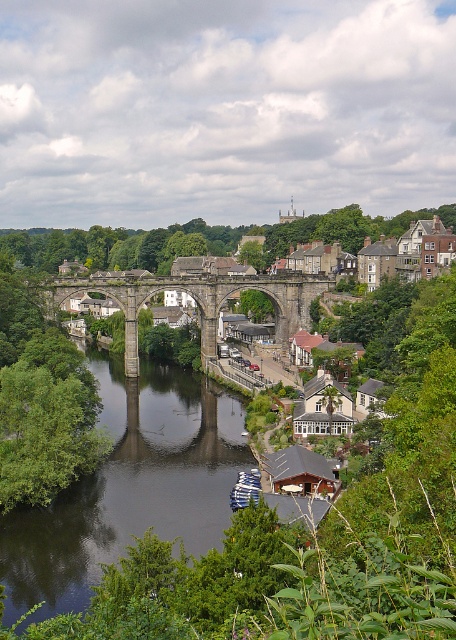
You are a tourist standing on the stone arch bridge at center and want to take a photo of the dark reflective water at center. Since the bridge is higher, will you need to look down to capture the water in your shot?

The dark reflective water at center has a lesser height compared to the stone arch bridge at center, so yes, you will need to look down to capture the water in your shot since the bridge is elevated above it.

You are a tour guide leading a group near the river. You want to point out both the dark reflective water at center and the stone arch bridge at center. If your arm can reach up to 100 feet, can you touch both objects with your outstretched hand at the same time?

The dark reflective water at center and the stone arch bridge at center are 113.69 feet apart. Since your arm can only reach up to 100 feet, you cannot touch both objects with your outstretched hand at the same time.

You are a tourist standing on the stone arch bridge at center and want to take a photo of the dark reflective water at center. Can you see the water from your current position on the bridge?

The dark reflective water at center is below the stone arch bridge at center, so yes, you can see the dark reflective water at center from your position on the stone arch bridge at center.